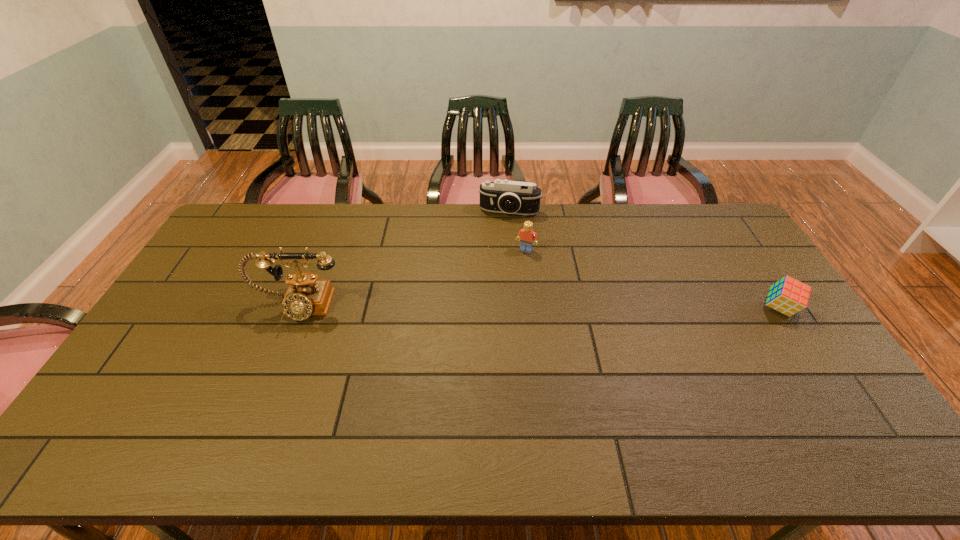
I want to click on free region located on the front-facing side of the second farthest object, so click(502, 293).

Find the location of `vacant space situated on the front lens of the camera`. vacant space situated on the front lens of the camera is located at coordinates (492, 288).

The width and height of the screenshot is (960, 540). Identify the location of free space located on the front lens of the camera. (495, 265).

Image resolution: width=960 pixels, height=540 pixels. I want to click on free space located on the front lens of the camera, so click(493, 278).

Locate an element on the screen. object located at the far edge is located at coordinates (501, 196).

Locate an element on the screen. The height and width of the screenshot is (540, 960). object at the right edge is located at coordinates (788, 296).

Identify the location of vacant area at the far edge of the desktop. The image size is (960, 540). (463, 209).

Locate an element on the screen. Image resolution: width=960 pixels, height=540 pixels. vacant space at the near edge is located at coordinates [497, 392].

Find the location of a particular element. This screenshot has height=540, width=960. vacant space at the left edge of the desktop is located at coordinates (173, 374).

Locate an element on the screen. vacant space at the right edge of the desktop is located at coordinates (739, 253).